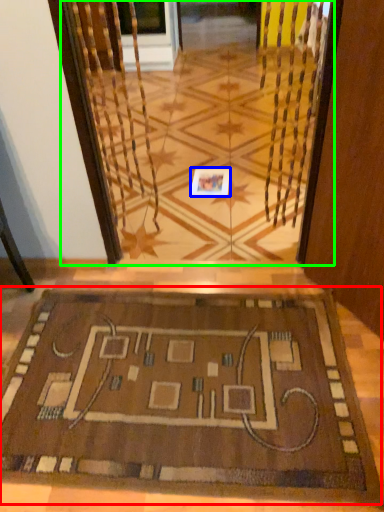
Question: Estimate the real-world distances between objects in this image. Which object is closer to mat (highlighted by a red box), square (highlighted by a blue box) or glass door (highlighted by a green box)?

Choices:
 (A) square
 (B) glass door

Answer: (A)